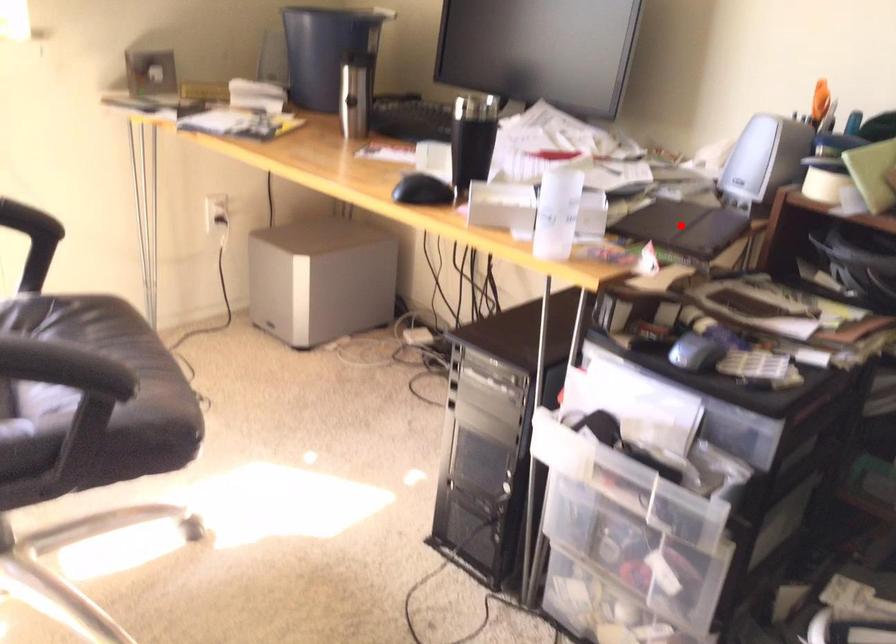
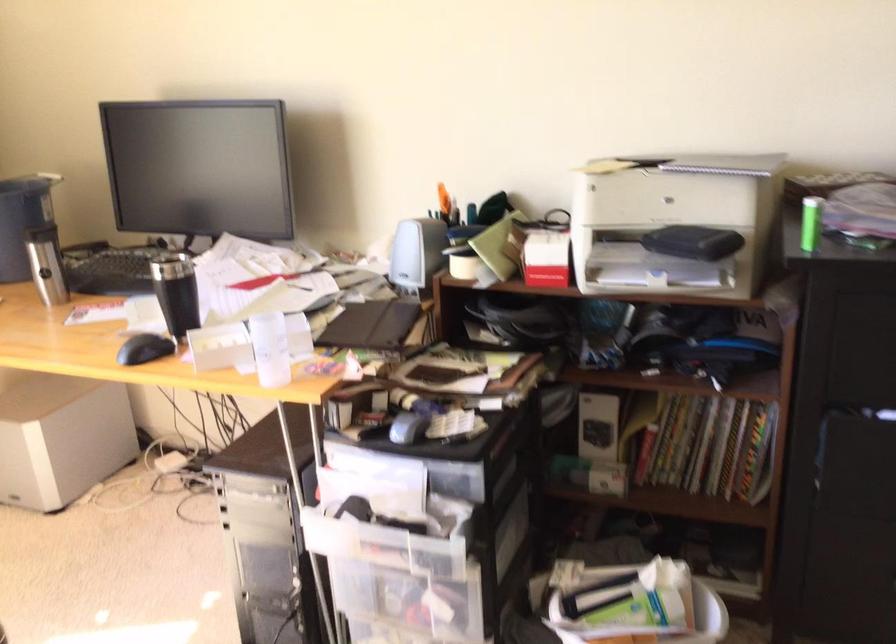
Locate, in the second image, the point that corresponds to the highlighted location in the first image.

(372, 325)